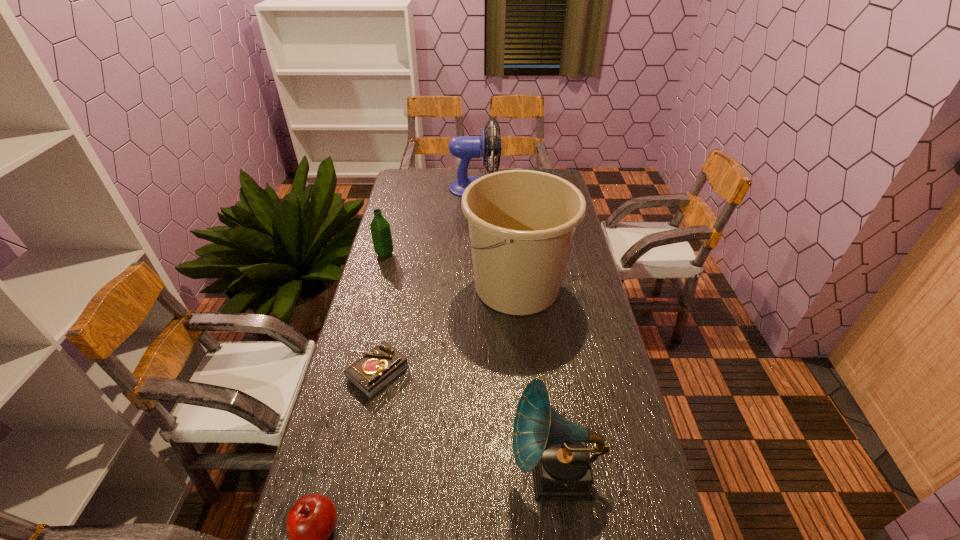
Where is `free space at the right edge of the desktop`? The image size is (960, 540). free space at the right edge of the desktop is located at coordinates (575, 410).

I want to click on vacant area between the bucket and the third shortest object, so click(x=451, y=270).

Where is `vacant area that lies between the shortest object and the water bottle`? vacant area that lies between the shortest object and the water bottle is located at coordinates (381, 313).

Where is `vacant space that's between the water bottle and the shortest object`? vacant space that's between the water bottle and the shortest object is located at coordinates (381, 313).

This screenshot has height=540, width=960. I want to click on free space that is in between the farthest object and the phonograph_record, so tap(515, 330).

Where is `vacant area that lies between the water bottle and the bucket`? This screenshot has width=960, height=540. vacant area that lies between the water bottle and the bucket is located at coordinates (451, 270).

Find the location of `unoccupied area between the third shortest object and the phonograph_record`. unoccupied area between the third shortest object and the phonograph_record is located at coordinates (470, 363).

At what (x,y) coordinates should I click in order to perform the action: click on free space between the fan and the diary. Please return your answer as a coordinate pair (x, y). The width and height of the screenshot is (960, 540). Looking at the image, I should click on (426, 280).

Locate which object ranks fifth in proximity to the farthest object. Please provide its 2D coordinates. Your answer should be formatted as a tuple, i.e. [(x, y)], where the tuple contains the x and y coordinates of a point satisfying the conditions above.

[(310, 522)]

The height and width of the screenshot is (540, 960). In order to click on the second closest object relative to the bucket in this screenshot , I will do click(380, 229).